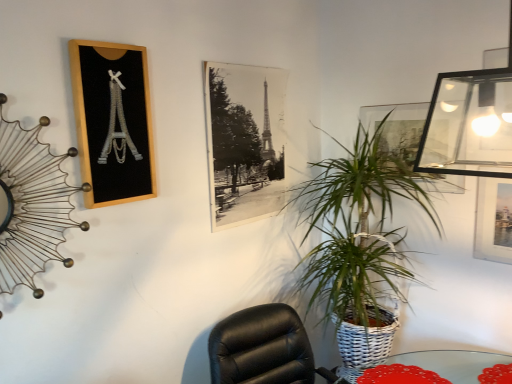
Question: Is gold wire clock at upper left at the left side of transparent glass picture frame at upper right, placed as the 3th picture frame when sorted from left to right?

Choices:
 (A) yes
 (B) no

Answer: (A)

Question: Considering the relative sizes of gold wire clock at upper left and transparent glass picture frame at upper right, the first picture frame positioned from the right, in the image provided, is gold wire clock at upper left thinner than transparent glass picture frame at upper right, the first picture frame positioned from the right,?

Choices:
 (A) yes
 (B) no

Answer: (B)

Question: Is the position of gold wire clock at upper left less distant than that of transparent glass picture frame at upper right, placed as the 3th picture frame when sorted from left to right?

Choices:
 (A) yes
 (B) no

Answer: (A)

Question: From the image's perspective, is gold wire clock at upper left under transparent glass picture frame at upper right, placed as the 3th picture frame when sorted from left to right?

Choices:
 (A) no
 (B) yes

Answer: (B)

Question: Could you tell me if gold wire clock at upper left is turned towards transparent glass picture frame at upper right, placed as the 3th picture frame when sorted from left to right?

Choices:
 (A) yes
 (B) no

Answer: (B)

Question: Is green woven basket at center-right taller or shorter than transparent glass picture frame at upper right, placed as the 3th picture frame when sorted from left to right?

Choices:
 (A) short
 (B) tall

Answer: (B)

Question: Choose the correct answer: Is green woven basket at center-right inside transparent glass picture frame at upper right, the first picture frame positioned from the right, or outside it?

Choices:
 (A) outside
 (B) inside

Answer: (A)

Question: Is green woven basket at center-right wider or thinner than transparent glass picture frame at upper right, placed as the 3th picture frame when sorted from left to right?

Choices:
 (A) wide
 (B) thin

Answer: (A)

Question: From the image's perspective, is green woven basket at center-right located above or below transparent glass picture frame at upper right, placed as the 3th picture frame when sorted from left to right?

Choices:
 (A) below
 (B) above

Answer: (A)

Question: Is wooden picture frame at upper left, acting as the first picture frame starting from the left, in front of or behind green woven basket at center-right in the image?

Choices:
 (A) front
 (B) behind

Answer: (A)

Question: In terms of height, does wooden picture frame at upper left, the 3th picture frame from the right, look taller or shorter compared to green woven basket at center-right?

Choices:
 (A) tall
 (B) short

Answer: (B)

Question: Is wooden picture frame at upper left, acting as the first picture frame starting from the left, to the left or to the right of green woven basket at center-right in the image?

Choices:
 (A) left
 (B) right

Answer: (A)

Question: Is point (96, 69) closer or farther from the camera than point (359, 231)?

Choices:
 (A) farther
 (B) closer

Answer: (B)

Question: From the image's perspective, is black paper at center, the 2th picture frame positioned from the right, above or below gold wire clock at upper left?

Choices:
 (A) above
 (B) below

Answer: (A)

Question: Considering the positions of point (245, 109) and point (39, 261), is point (245, 109) closer or farther from the camera than point (39, 261)?

Choices:
 (A) closer
 (B) farther

Answer: (B)